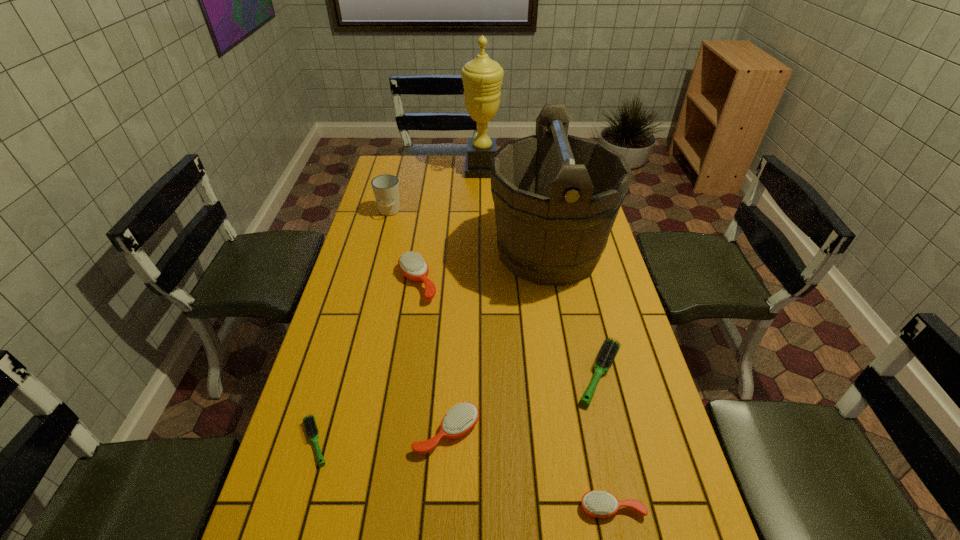
This screenshot has width=960, height=540. I want to click on the farthest object, so click(482, 77).

Identify the location of the tallest object. (482, 77).

You are a GUI agent. You are given a task and a screenshot of the screen. Output one action in this format:
    pyautogui.click(x=<x>, y=<y>)
    Task: Click on the bucket
    This screenshot has width=960, height=540.
    Given the screenshot: What is the action you would take?
    pyautogui.click(x=556, y=198)

Where is `white cup`? The width and height of the screenshot is (960, 540). white cup is located at coordinates (385, 187).

Locate an element on the screen. The height and width of the screenshot is (540, 960). cup is located at coordinates (385, 187).

This screenshot has width=960, height=540. I want to click on the farthest hairbrush, so [412, 265].

You are a GUI agent. You are given a task and a screenshot of the screen. Output one action in this format:
    pyautogui.click(x=<x>, y=<y>)
    Task: Click on the farthest orange hairbrush
    The height and width of the screenshot is (540, 960).
    Given the screenshot: What is the action you would take?
    pyautogui.click(x=412, y=265)

Find the location of a particular element. This screenshot has height=540, width=960. the second smallest orange hairbrush is located at coordinates (459, 420).

Where is `the second tallest hairbrush`? The height and width of the screenshot is (540, 960). the second tallest hairbrush is located at coordinates (459, 420).

You are a GUI agent. You are given a task and a screenshot of the screen. Output one action in this format:
    pyautogui.click(x=<x>, y=<y>)
    Task: Click on the bigger light hairbrush
    
    Given the screenshot: What is the action you would take?
    pyautogui.click(x=609, y=349)